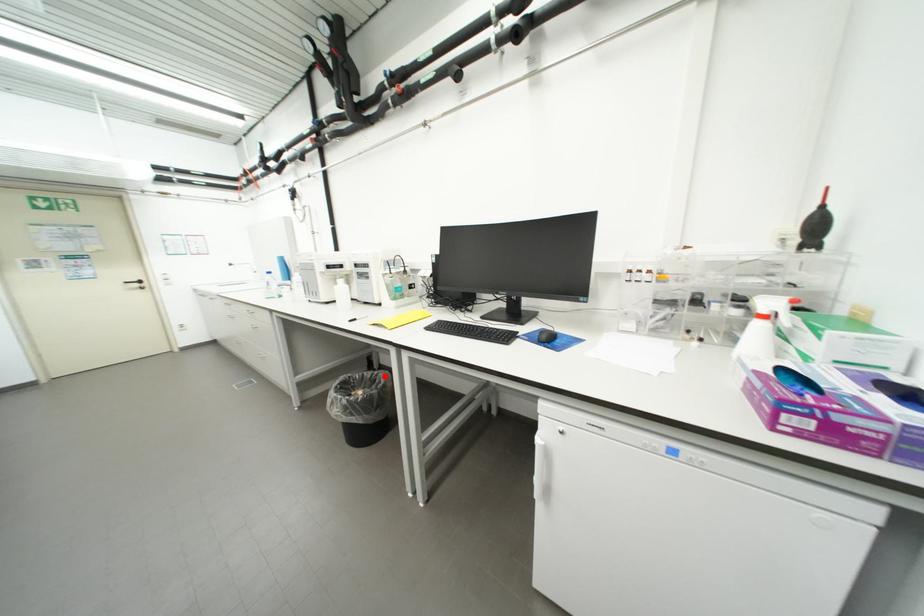
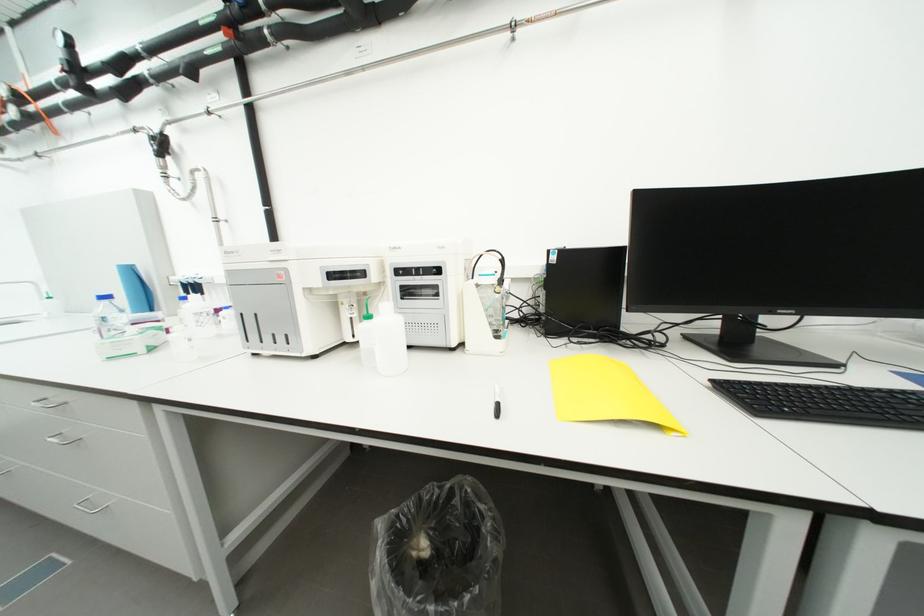
Question: I am providing you with two images of the same scene from different viewpoints. Image1 has a red point marked. In image2, the corresponding 3D location appears at what relative position? Reply with the corresponding letter.

Choices:
 (A) Closer
 (B) Farther

Answer: (A)